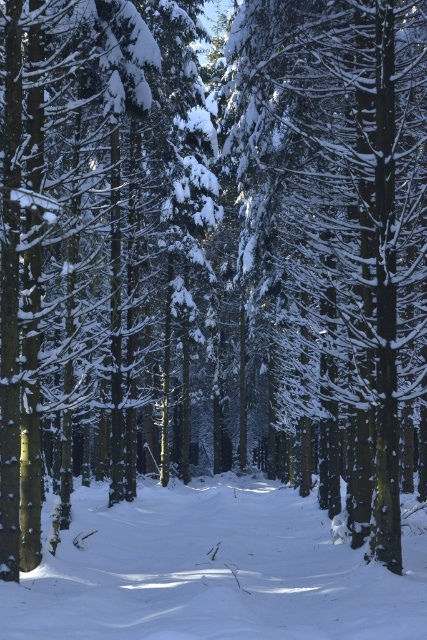
Between point (310, 394) and point (151, 589), which one is positioned behind?

The point (310, 394) is more distant.

Consider the image. Does snow-covered tree at center appear over white powdery snow at center?

Indeed, snow-covered tree at center is positioned over white powdery snow at center.

This screenshot has height=640, width=427. I want to click on snow-covered tree at center, so click(x=342, y=230).